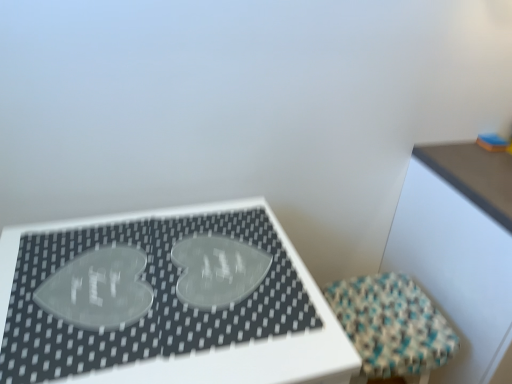
Find the location of `free point above textured woven stool at lower right (from a real-world perspective)`. free point above textured woven stool at lower right (from a real-world perspective) is located at coordinates (396, 316).